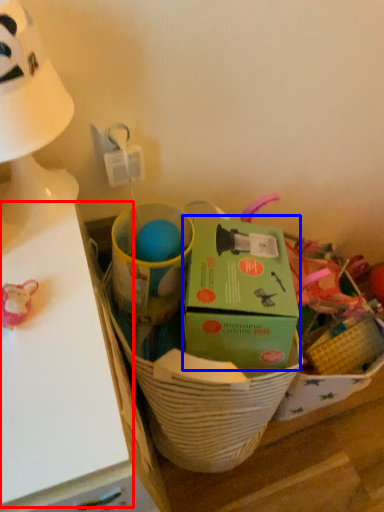
Question: Which of the following is the closest to the observer, table (highlighted by a red box) or box (highlighted by a blue box)?

Choices:
 (A) table
 (B) box

Answer: (A)